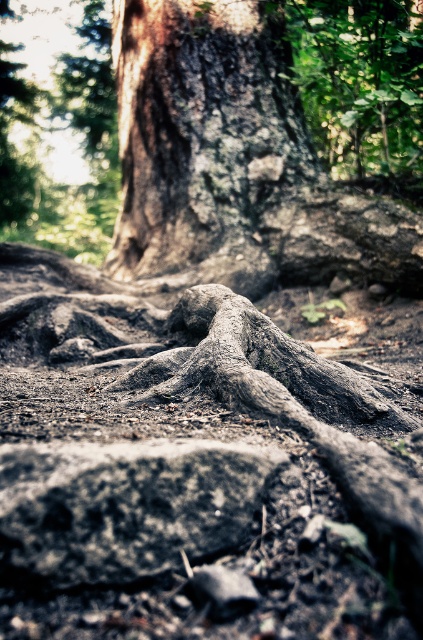
Which is more to the left, dark brown rough bark at center or smooth gray rock at center?

Positioned to the left is dark brown rough bark at center.

Which is behind, point (417, 248) or point (186, 481)?

Positioned behind is point (417, 248).

The image size is (423, 640). What are the coordinates of `dark brown rough bark at center` in the screenshot? It's located at (233, 160).

Is dark brown rough bark at center thinner than gray textured roots at center?

No, dark brown rough bark at center is not thinner than gray textured roots at center.

Does dark brown rough bark at center have a greater width compared to gray textured roots at center?

Indeed, dark brown rough bark at center has a greater width compared to gray textured roots at center.

Between point (203, 42) and point (349, 401), which one is positioned in front?

Point (349, 401)

At what (x,y) coordinates should I click in order to perform the action: click on dark brown rough bark at center. Please return your answer as a coordinate pair (x, y). Looking at the image, I should click on (233, 160).

Which is in front, point (224, 465) or point (288, 356)?

Positioned in front is point (224, 465).

Does smooth gray rock at center have a greater height compared to gray textured roots at center?

No, smooth gray rock at center is not taller than gray textured roots at center.

Who is more forward, (95, 550) or (208, 333)?

Positioned in front is point (95, 550).

Find the location of a particular element. smooth gray rock at center is located at coordinates (125, 506).